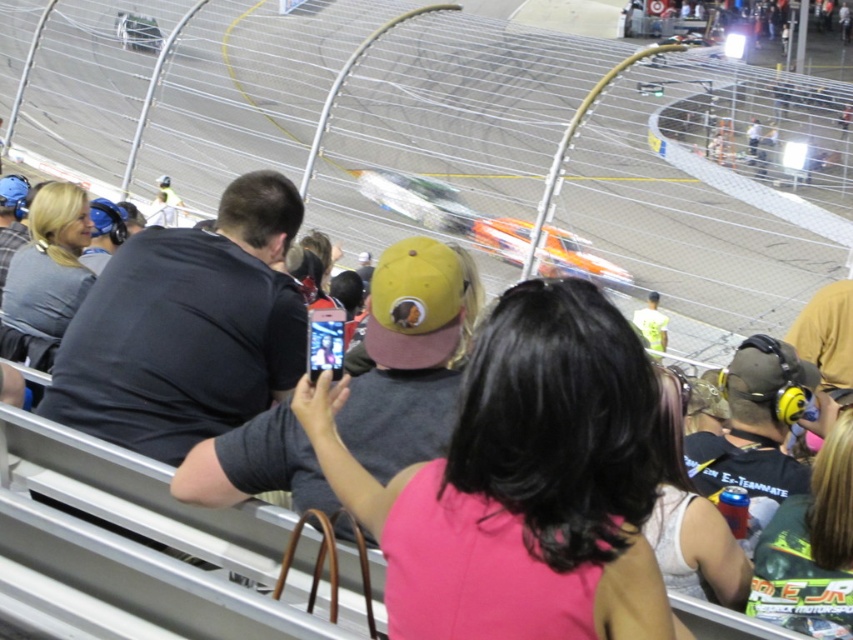
Question: Which point is farther from the camera taking this photo?

Choices:
 (A) (146, 61)
 (B) (492, 413)

Answer: (A)

Question: From the image, what is the correct spatial relationship of smooth asphalt race track at center in relation to pink fabric shirt at center?

Choices:
 (A) right
 (B) left

Answer: (A)

Question: Where is smooth asphalt race track at center located in relation to pink fabric shirt at center in the image?

Choices:
 (A) right
 (B) left

Answer: (A)

Question: Is smooth asphalt race track at center below pink fabric shirt at center?

Choices:
 (A) yes
 (B) no

Answer: (B)

Question: Which point is farther from the camera taking this photo?

Choices:
 (A) (723, 259)
 (B) (589, 348)

Answer: (A)